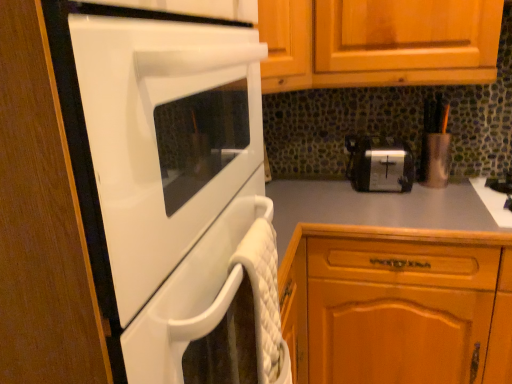
I want to click on free region under black matte gas stove at right (from a real-world perspective), so click(x=489, y=196).